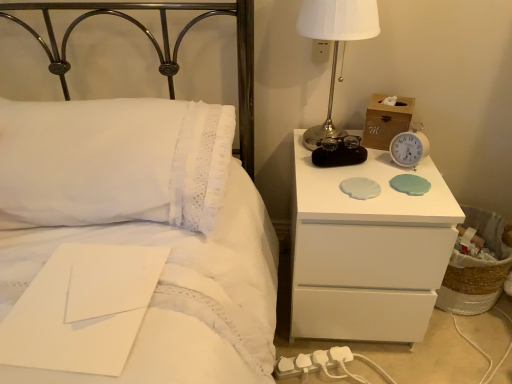
This screenshot has height=384, width=512. In order to click on free spot in front of white plastic alarm clock at upper right, which is counted as the 2th alarm clock, starting from the right in this screenshot , I will do `click(349, 195)`.